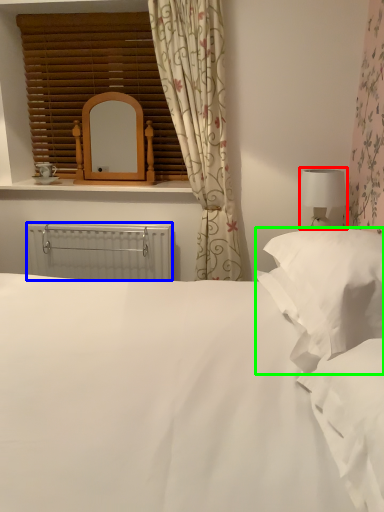
Question: Considering the real-world distances, which object is farthest from table lamp (highlighted by a red box)? radiator (highlighted by a blue box) or pillow (highlighted by a green box)?

Choices:
 (A) radiator
 (B) pillow

Answer: (A)